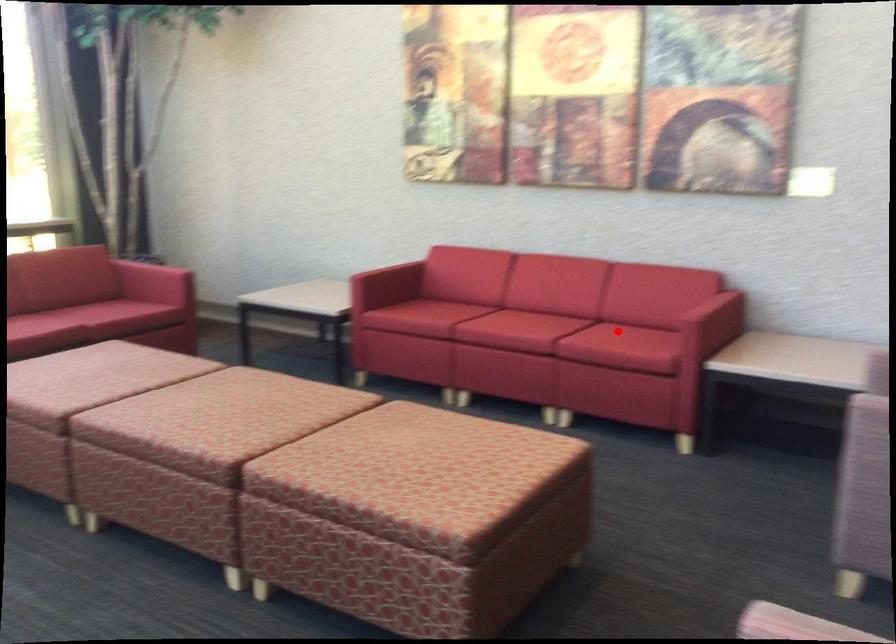
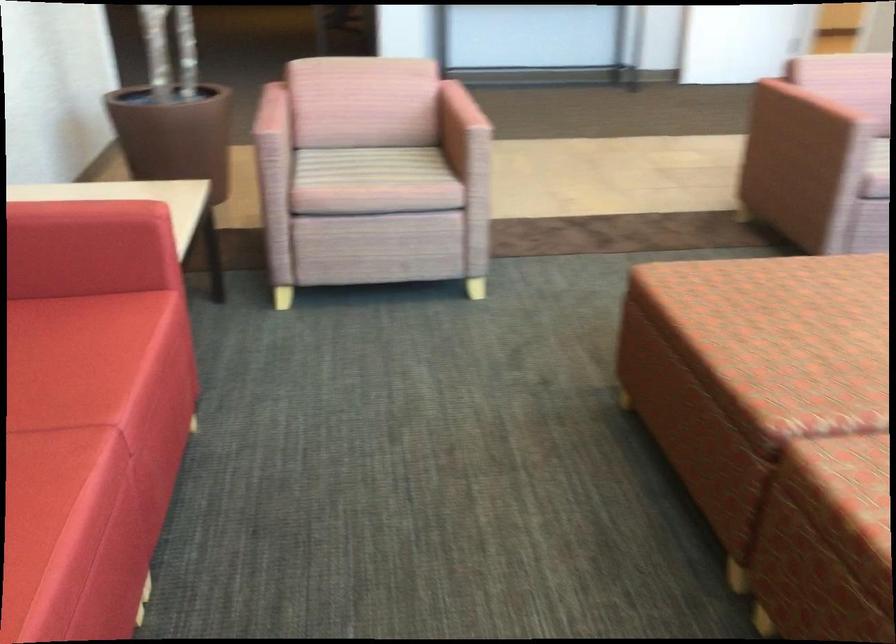
Where in the second image is the point corresponding to the highlighted location from the first image?

(69, 360)